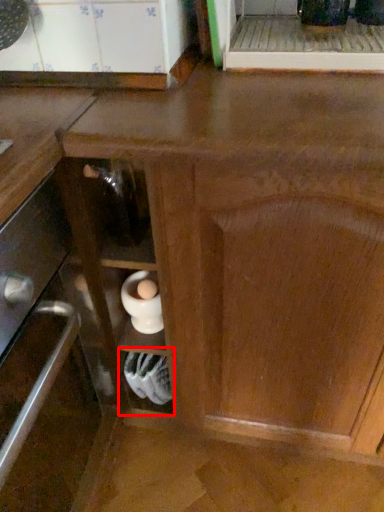
Question: From the image's perspective, what is the correct spatial positioning of shelf (annotated by the red box) in reference to appliance?

Choices:
 (A) above
 (B) below

Answer: (B)